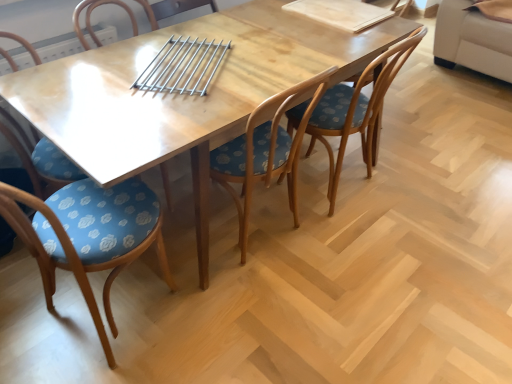
This screenshot has height=384, width=512. I want to click on blank space to the left of blue fabric chair at center, positioned as the 3th chair in right-to-left order, so click(x=25, y=307).